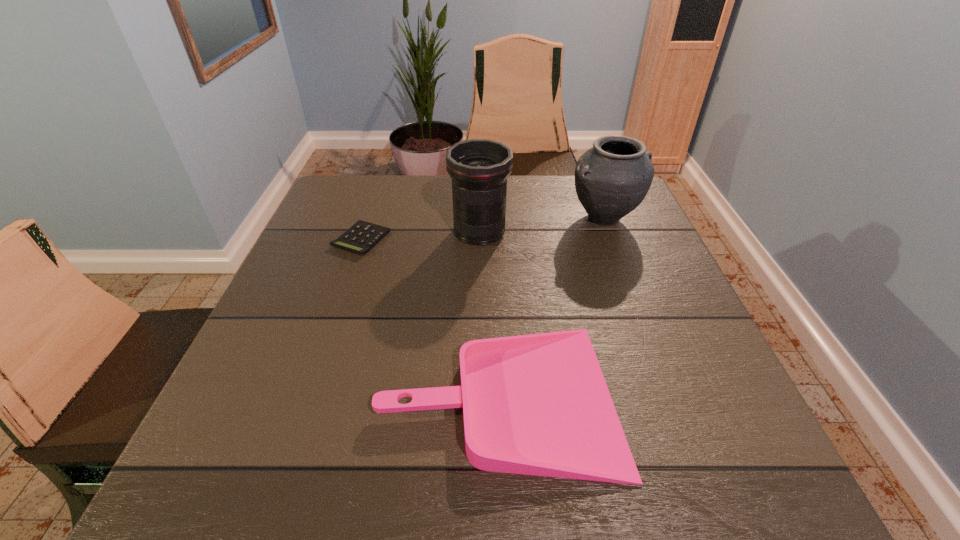
I want to click on telephoto lens, so click(x=479, y=168).

Find the location of `urn`. urn is located at coordinates (612, 178).

The image size is (960, 540). What are the coordinates of `the nearest object` in the screenshot? It's located at (538, 404).

Where is `dustpan`? The height and width of the screenshot is (540, 960). dustpan is located at coordinates (538, 404).

You are a GUI agent. You are given a task and a screenshot of the screen. Output one action in this format:
    pyautogui.click(x=<x>, y=<y>)
    Task: Click on the leftmost object
    The height and width of the screenshot is (540, 960).
    Given the screenshot: What is the action you would take?
    click(360, 238)

Locate an element on the screen. calculator is located at coordinates (360, 238).

Image resolution: width=960 pixels, height=540 pixels. In order to click on vacant space located 0.190m on the front of the telephoto lens in this screenshot , I will do `click(479, 305)`.

This screenshot has height=540, width=960. Identify the location of free spot located 0.330m on the front of the urn. (651, 340).

Identify the location of vacant space located on the handle side of the dustpan. The width and height of the screenshot is (960, 540). (222, 396).

Identify the location of vacant position located 0.230m on the handle side of the dustpan. The image size is (960, 540). (246, 396).